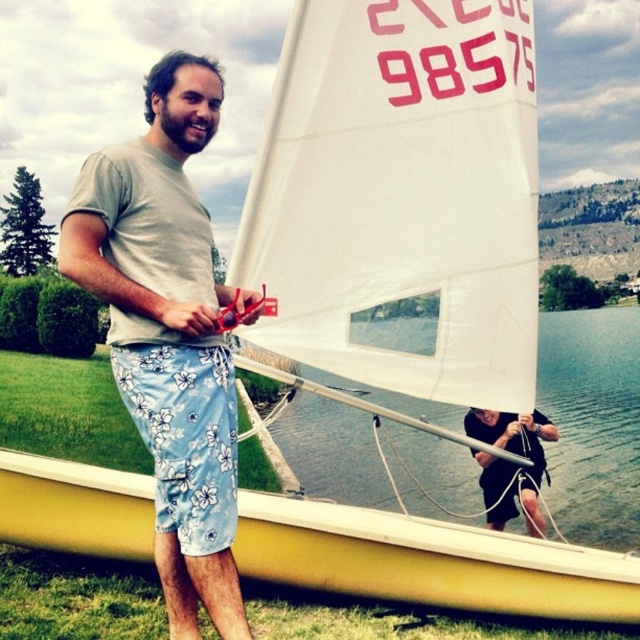
You are standing at the point marked by the coordinates point (429,561) in the image. What object is located at that point?

The point (429,561) indicates yellow plastic canoe at lower left.

You are a person with a 6 feet long ladder that you need to place between the yellow plastic canoe at lower left and the blue floral shorts at center. Can the ladder fit between them without bending?

The distance between the yellow plastic canoe at lower left and the blue floral shorts at center is 9.03 feet, which is longer than the ladder length of 6 feet. Therefore, the ladder can fit between them without bending.